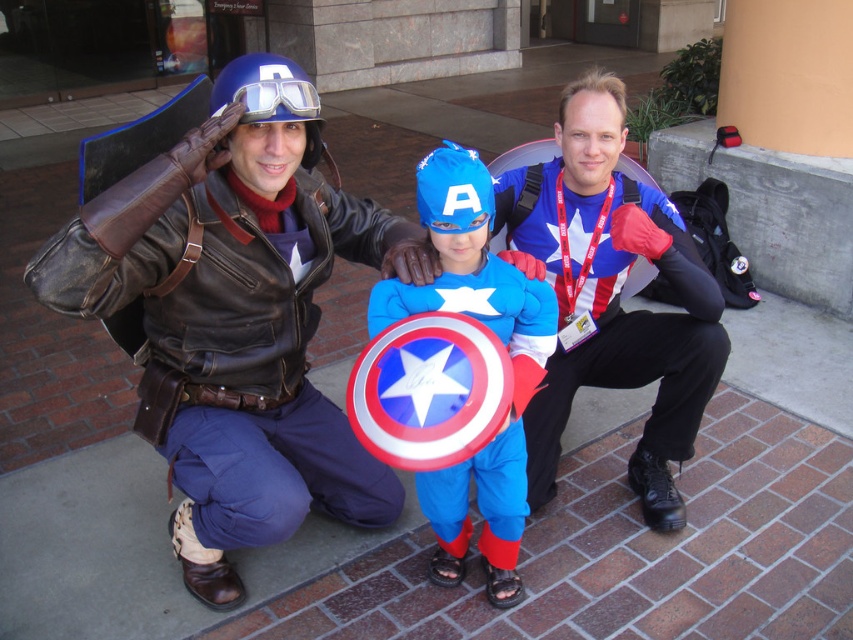
You are a costume designer analyzing the superhero group photo. Which object has a greater width between the blue fabric shirt at center and the shiny blue costume at center?

The blue fabric shirt at center has a greater width than the shiny blue costume at center according to the description.

From the picture: You are a photographer taking a picture of the superhero group. You notice the blue fabric shirt at center and the blue matte helmet at upper center. Which object is positioned lower in the image?

The blue fabric shirt at center is positioned below the blue matte helmet at upper center, so the blue fabric shirt at center is lower in the image.

Where is the blue fabric shirt at center located in the image?

The blue fabric shirt at center is located at point [611,294].